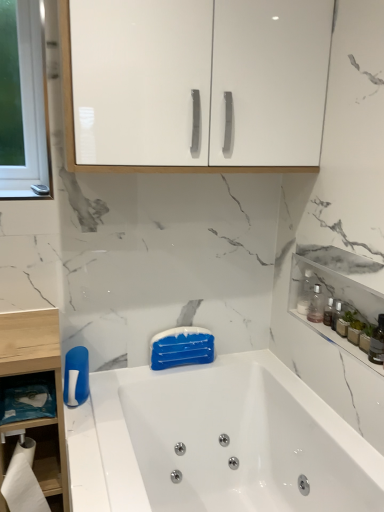
Question: In which direction should I rotate to look at white glossy cabinet at upper center, arranged as the first cabinetry when viewed from the left?

Choices:
 (A) left
 (B) right

Answer: (B)

Question: From the image's perspective, is white glossy bathtub at center located above white paper at lower left?

Choices:
 (A) yes
 (B) no

Answer: (B)

Question: Considering the relative sizes of white glossy bathtub at center and white paper at lower left in the image provided, is white glossy bathtub at center smaller than white paper at lower left?

Choices:
 (A) no
 (B) yes

Answer: (A)

Question: Can you confirm if white glossy bathtub at center is bigger than white paper at lower left?

Choices:
 (A) no
 (B) yes

Answer: (B)

Question: Is the surface of white glossy bathtub at center in direct contact with white paper at lower left?

Choices:
 (A) yes
 (B) no

Answer: (B)

Question: Considering the relative sizes of white glossy bathtub at center and white paper at lower left in the image provided, is white glossy bathtub at center taller than white paper at lower left?

Choices:
 (A) no
 (B) yes

Answer: (B)

Question: Does white glossy bathtub at center have a lesser width compared to white paper at lower left?

Choices:
 (A) yes
 (B) no

Answer: (B)

Question: From the image's perspective, would you say white glossy bathtub at center is positioned over translucent glass bottles at upper right, the first cabinetry when ordered from bottom to top?

Choices:
 (A) no
 (B) yes

Answer: (A)

Question: From a real-world perspective, is white glossy bathtub at center on top of translucent glass bottles at upper right, the first cabinetry when ordered from bottom to top?

Choices:
 (A) no
 (B) yes

Answer: (A)

Question: Could translucent glass bottles at upper right, the first cabinetry when ordered from bottom to top, be considered to be inside white glossy bathtub at center?

Choices:
 (A) no
 (B) yes

Answer: (A)

Question: Is white glossy bathtub at center positioned in front of translucent glass bottles at upper right, arranged as the second cabinetry when viewed from the top?

Choices:
 (A) yes
 (B) no

Answer: (A)

Question: Is white glossy bathtub at center to the left of translucent glass bottles at upper right, the first cabinetry when ordered from bottom to top, from the viewer's perspective?

Choices:
 (A) yes
 (B) no

Answer: (A)

Question: Is white glossy bathtub at center facing away from translucent glass bottles at upper right, arranged as the second cabinetry when viewed from the top?

Choices:
 (A) no
 (B) yes

Answer: (A)

Question: Could clear plastic bottle at upper right be considered to be inside translucent glass bottle at right?

Choices:
 (A) no
 (B) yes

Answer: (A)